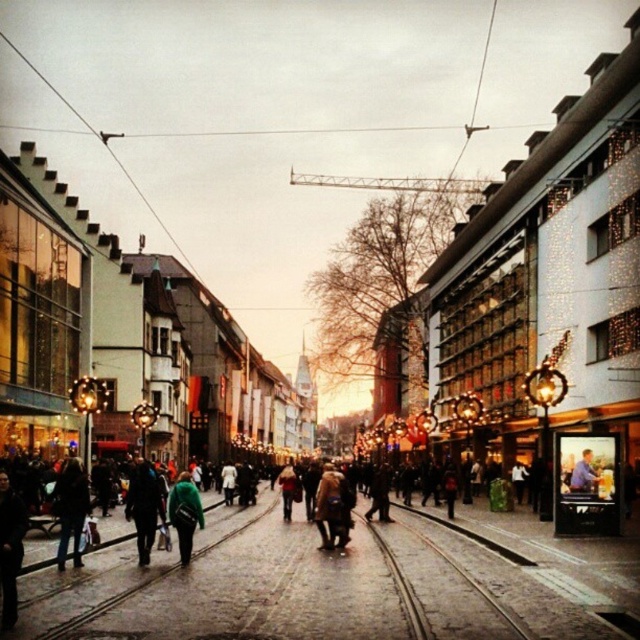
Can you confirm if dark blue jacket at center is positioned to the right of brown fuzzy coat at center?

Incorrect, dark blue jacket at center is not on the right side of brown fuzzy coat at center.

Between point (138, 474) and point (323, 545), which one is positioned in front?

Positioned in front is point (138, 474).

Describe the element at coordinates (145, 506) in the screenshot. This screenshot has width=640, height=640. I see `dark blue jacket at center` at that location.

The height and width of the screenshot is (640, 640). Identify the location of dark blue jacket at center. (145, 506).

Between dark blue jacket at lower left and dark brown leather jacket at center, which one appears on the left side from the viewer's perspective?

dark blue jacket at lower left

Where is `dark blue jacket at lower left`? This screenshot has width=640, height=640. dark blue jacket at lower left is located at coordinates (70, 508).

Where is `dark blue jacket at lower left`? Image resolution: width=640 pixels, height=640 pixels. dark blue jacket at lower left is located at coordinates (70, 508).

How far apart are gray concrete train track at center and blue denim jacket at center?

gray concrete train track at center is 25.78 meters from blue denim jacket at center.

Where is `gray concrete train track at center`? gray concrete train track at center is located at coordinates (474, 584).